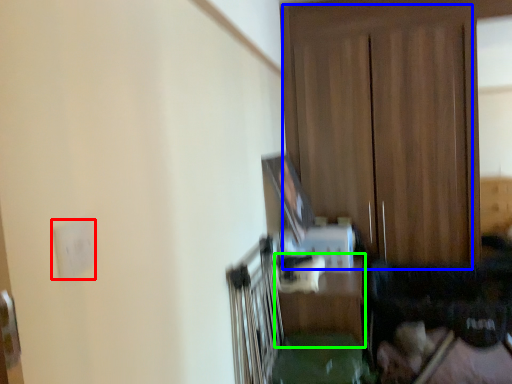
Question: Which is nearer to the electric outlet (highlighted by a red box)? dresser (highlighted by a blue box) or table (highlighted by a green box).

Choices:
 (A) dresser
 (B) table

Answer: (B)